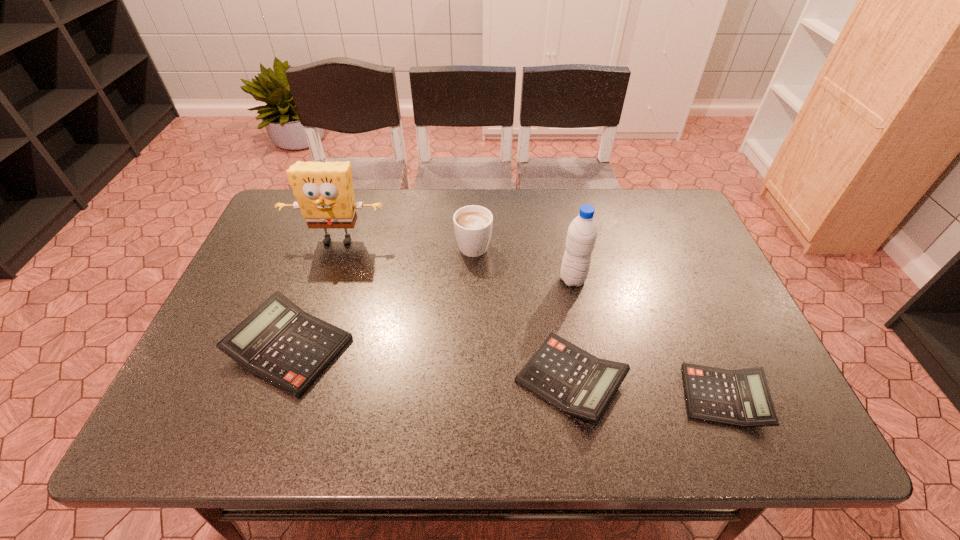
Please point a space for a new calculator to maintain equal intervals. Please provide its 2D coordinates. Your answer should be formatted as a tuple, i.e. [(x, y)], where the tuple contains the x and y coordinates of a point satisfying the conditions above.

[(426, 363)]